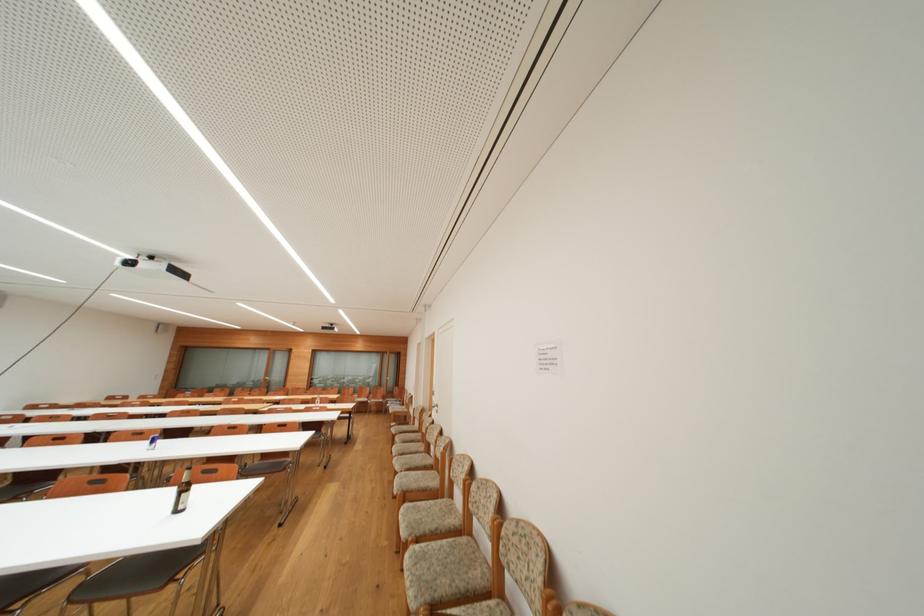
At what (x,y) coordinates should I click in order to perform the action: click on blue drink can. Please return your answer as a coordinate pair (x, y). Looking at the image, I should click on click(x=152, y=440).